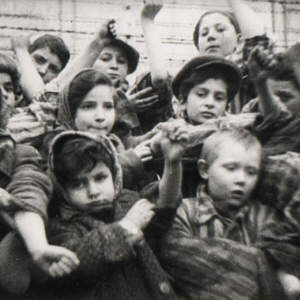
I want to click on wall, so click(x=182, y=26).